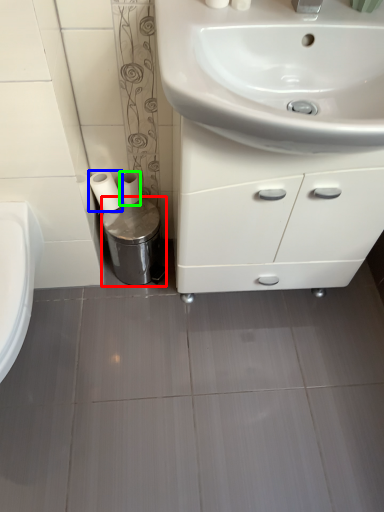
Question: Estimate the real-world distances between objects in this image. Which object is farther from bidet (highlighted by a red box), toilet paper (highlighted by a blue box) or toilet paper (highlighted by a green box)?

Choices:
 (A) toilet paper
 (B) toilet paper

Answer: (A)